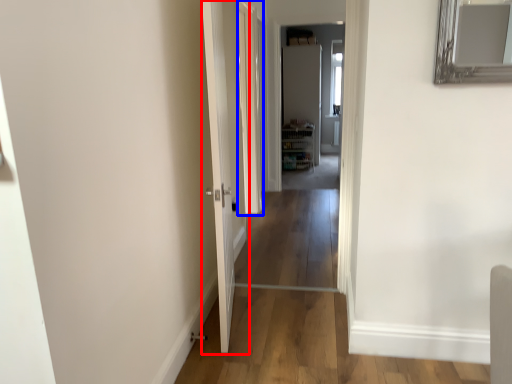
Question: Which object appears farthest to the camera in this image, door (highlighted by a red box) or glass door (highlighted by a blue box)?

Choices:
 (A) door
 (B) glass door

Answer: (B)